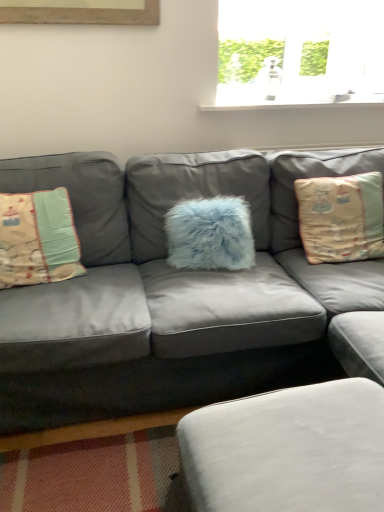
Question: Would you consider matte gray couch at center to be distant from white fabric footrest at lower center?

Choices:
 (A) yes
 (B) no

Answer: (B)

Question: Is matte gray couch at center facing towards white fabric footrest at lower center?

Choices:
 (A) no
 (B) yes

Answer: (B)

Question: Considering the relative sizes of matte gray couch at center and white fabric footrest at lower center in the image provided, is matte gray couch at center bigger than white fabric footrest at lower center?

Choices:
 (A) yes
 (B) no

Answer: (A)

Question: Is matte gray couch at center turned away from white fabric footrest at lower center?

Choices:
 (A) yes
 (B) no

Answer: (B)

Question: Does matte gray couch at center have a greater width compared to white fabric footrest at lower center?

Choices:
 (A) yes
 (B) no

Answer: (A)

Question: Considering the positions of fluffy blue pillow at center, which is the second pillow in left-to-right order, and white fabric footrest at lower center in the image, is fluffy blue pillow at center, which is the second pillow in left-to-right order, wider or thinner than white fabric footrest at lower center?

Choices:
 (A) wide
 (B) thin

Answer: (B)

Question: Is fluffy blue pillow at center, the second pillow viewed from the right, in front of or behind white fabric footrest at lower center in the image?

Choices:
 (A) front
 (B) behind

Answer: (B)

Question: Would you say fluffy blue pillow at center, which is the second pillow in left-to-right order, is to the left or to the right of white fabric footrest at lower center in the picture?

Choices:
 (A) left
 (B) right

Answer: (A)

Question: Is point (173, 211) closer or farther from the camera than point (374, 429)?

Choices:
 (A) closer
 (B) farther

Answer: (B)

Question: In terms of height, does beige fabric pillow at left, the 3th pillow positioned from the right, look taller or shorter compared to white fabric footrest at lower center?

Choices:
 (A) short
 (B) tall

Answer: (B)

Question: In the image, is beige fabric pillow at left, the 3th pillow positioned from the right, positioned in front of or behind white fabric footrest at lower center?

Choices:
 (A) front
 (B) behind

Answer: (B)

Question: Considering the positions of point (23, 246) and point (210, 490), is point (23, 246) closer or farther from the camera than point (210, 490)?

Choices:
 (A) closer
 (B) farther

Answer: (B)

Question: From the image's perspective, is beige fabric pillow at left, the first pillow in the left-to-right sequence, above or below white fabric footrest at lower center?

Choices:
 (A) below
 (B) above

Answer: (B)

Question: In terms of width, does beige fabric pillow at right, the first pillow positioned from the right, look wider or thinner when compared to beige fabric pillow at left, the first pillow in the left-to-right sequence?

Choices:
 (A) wide
 (B) thin

Answer: (A)

Question: From a real-world perspective, is beige fabric pillow at right, arranged as the 3th pillow when viewed from the left, positioned above or below beige fabric pillow at left, the first pillow in the left-to-right sequence?

Choices:
 (A) below
 (B) above

Answer: (B)